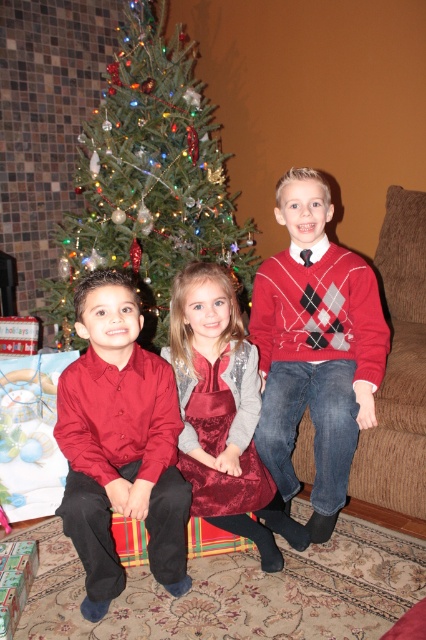
Consider the image. Who is taller, argyle sweater at center or velvet dress at center?

argyle sweater at center is taller.

Where is `argyle sweater at center`? The width and height of the screenshot is (426, 640). argyle sweater at center is located at coordinates (314, 348).

Can you confirm if green textured christmas tree at upper center is shorter than argyle sweater at center?

Incorrect, green textured christmas tree at upper center's height does not fall short of argyle sweater at center's.

Does green textured christmas tree at upper center appear over argyle sweater at center?

Yes.

Find the location of a particular element. The height and width of the screenshot is (640, 426). green textured christmas tree at upper center is located at coordinates (149, 179).

At what (x,y) coordinates should I click in order to perform the action: click on green textured christmas tree at upper center. Please return your answer as a coordinate pair (x, y). Looking at the image, I should click on (149, 179).

Is green textured christmas tree at upper center above velvet dress at center?

Correct, green textured christmas tree at upper center is located above velvet dress at center.

From the picture: Is green textured christmas tree at upper center positioned before velvet dress at center?

No, it is not.

Does point (123, 60) lie behind point (270, 493)?

That is True.

Identify the location of green textured christmas tree at upper center. This screenshot has width=426, height=640. pyautogui.click(x=149, y=179).